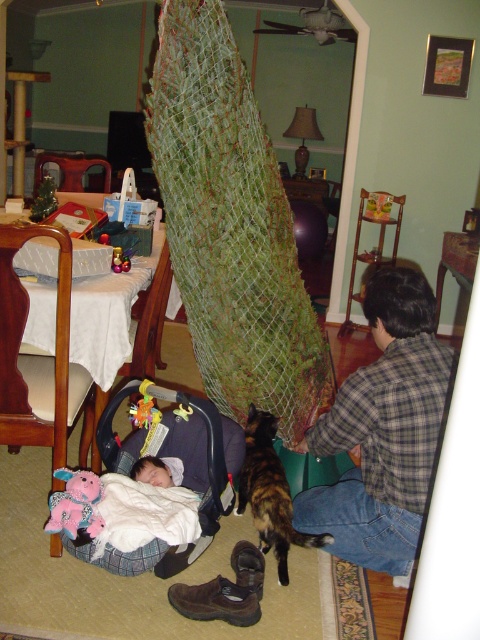
You are a parent trying to retrieve the soft white blanket at lower left to cover your child. The wooden chair at lower left is in the way. Can you reach the blanket without moving the chair?

The wooden chair at lower left is closer to the viewer than the soft white blanket at lower left, so you can reach the blanket without moving the chair because it is behind the chair.